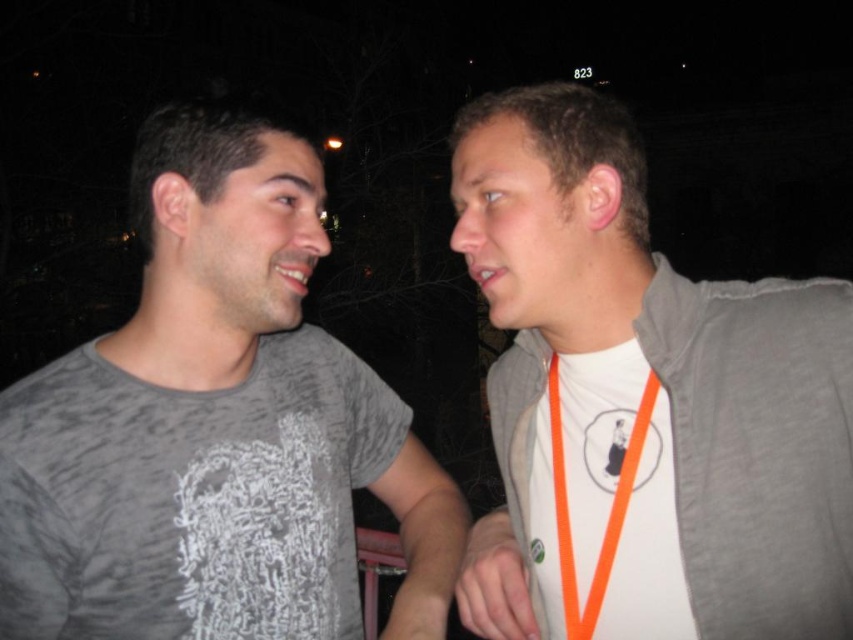
You are standing at the center of the image and want to locate the white fabric shirt at right. In which direction should you look relative to the center?

The white fabric shirt at right is located at point 0.631 on the x axis and 0.754 on the y axis, so you should look to the right and slightly upwards from the center.